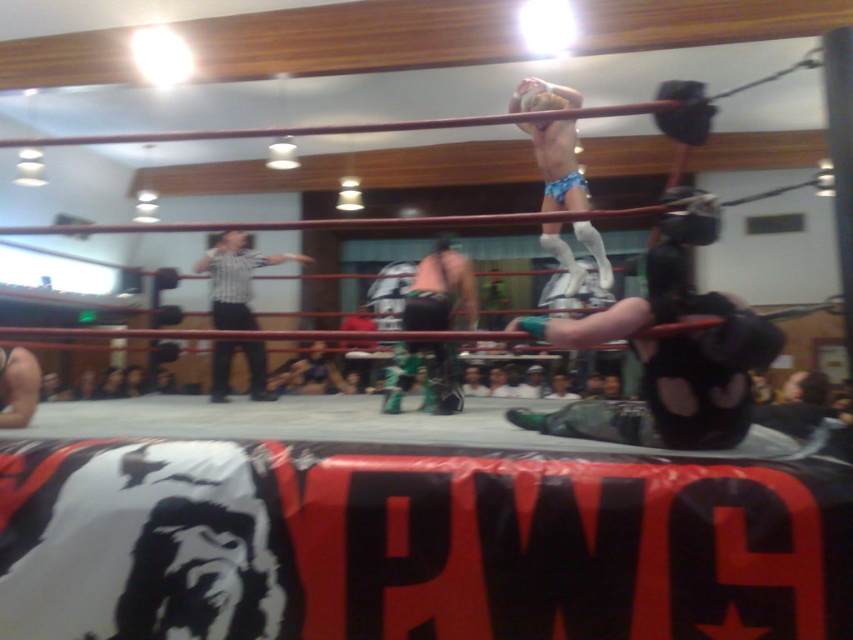
Question: Which object appears farthest from the camera in this image?

Choices:
 (A) green fabric pants at center
 (B) striped shirt at center
 (C) blue fabric shorts at upper right

Answer: (B)

Question: Where is blue fabric shorts at upper right located in relation to striped shirt at center in the image?

Choices:
 (A) below
 (B) above

Answer: (A)

Question: Which of the following is the closest to the observer?

Choices:
 (A) striped shirt at center
 (B) green fabric pants at center

Answer: (B)

Question: Which point is closer to the camera?

Choices:
 (A) (730, 387)
 (B) (258, 340)

Answer: (A)

Question: Is blue fabric shorts at upper right closer to camera compared to striped shirt at center?

Choices:
 (A) yes
 (B) no

Answer: (A)

Question: Can you confirm if green fabric pants at center is wider than striped shirt at center?

Choices:
 (A) no
 (B) yes

Answer: (A)